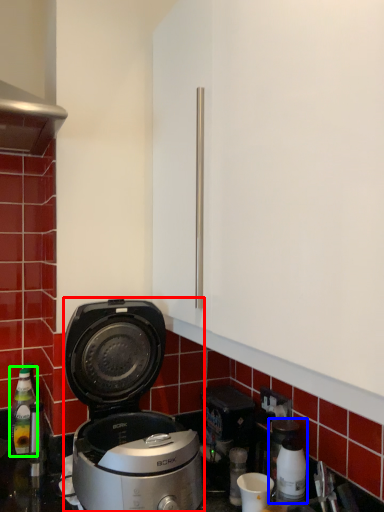
Question: Estimate the real-world distances between objects in this image. Which object is closer to kitchen appliance (highlighted by a red box), coffee machine (highlighted by a blue box) or bottle (highlighted by a green box)?

Choices:
 (A) coffee machine
 (B) bottle

Answer: (A)